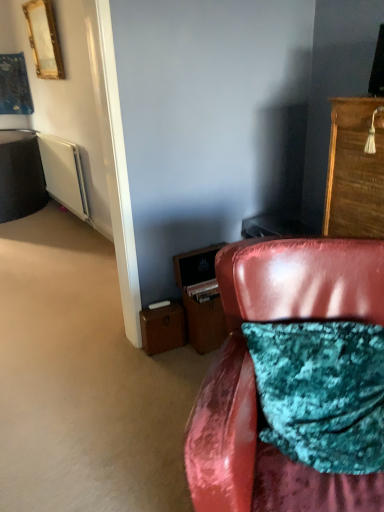
What do you see at coordinates (64, 174) in the screenshot?
I see `white matte radiator at left` at bounding box center [64, 174].

This screenshot has height=512, width=384. What do you see at coordinates (44, 39) in the screenshot? I see `gold-framed mirror at upper left` at bounding box center [44, 39].

Identify the location of gold-framed mirror at upper left. (44, 39).

Find the location of a particular element. This screenshot has width=384, height=512. wooden cabinet at upper right is located at coordinates (355, 170).

You are a GUI agent. You are given a task and a screenshot of the screen. Output one action in this format:
    pyautogui.click(x=<x>, y=<y>)
    Task: Click on the brown leather file cabinet at lower center
    
    Given the screenshot: What is the action you would take?
    pyautogui.click(x=201, y=298)

The width and height of the screenshot is (384, 512). Find the location of `white matte radiator at left`. white matte radiator at left is located at coordinates (64, 174).

Image resolution: width=384 pixels, height=512 pixels. Identify the location of chair above the wooden drawer at lower center, marked as the 1th drawer in a right-to-left arrangement (from a real-world perspective). (254, 376).

Is leather at lower right completely or partially outside of wooden drawer at lower center, marked as the 1th drawer in a right-to-left arrangement?

leather at lower right lies outside wooden drawer at lower center, marked as the 1th drawer in a right-to-left arrangement,'s area.

From the image's perspective, which object appears higher, leather at lower right or wooden drawer at lower center, which is counted as the second drawer, starting from the left?

wooden drawer at lower center, which is counted as the second drawer, starting from the left, is shown above in the image.

How distant is leather at lower right from wooden drawer at lower center, marked as the 1th drawer in a right-to-left arrangement?

33.70 inches.

Based on the photo, is wooden drawer at lower center, which is counted as the second drawer, starting from the left, completely or partially outside of brown leather suitcase at lower left, acting as the 2th drawer starting from the right?

Absolutely, wooden drawer at lower center, which is counted as the second drawer, starting from the left, is external to brown leather suitcase at lower left, acting as the 2th drawer starting from the right.

Is wooden drawer at lower center, marked as the 1th drawer in a right-to-left arrangement, facing towards brown leather suitcase at lower left, which ranks as the 1th drawer in left-to-right order?

No, wooden drawer at lower center, marked as the 1th drawer in a right-to-left arrangement, is not facing towards brown leather suitcase at lower left, which ranks as the 1th drawer in left-to-right order.

Which is farther from the camera, (204,313) or (161,310)?

The point (161,310) is farther.

The width and height of the screenshot is (384, 512). Find the location of `drawer that is below the wooden drawer at lower center, which is counted as the second drawer, starting from the left (from the image's perspective)`. drawer that is below the wooden drawer at lower center, which is counted as the second drawer, starting from the left (from the image's perspective) is located at coordinates (162, 328).

Consider the image. Can you confirm if wooden drawer at lower center, which is counted as the second drawer, starting from the left, is thinner than brown leather file cabinet at lower center?

Yes, wooden drawer at lower center, which is counted as the second drawer, starting from the left, is thinner than brown leather file cabinet at lower center.

Is wooden drawer at lower center, which is counted as the second drawer, starting from the left, with brown leather file cabinet at lower center?

Yes.

From their relative heights in the image, would you say wooden drawer at lower center, which is counted as the second drawer, starting from the left, is taller or shorter than brown leather file cabinet at lower center?

Clearly, wooden drawer at lower center, which is counted as the second drawer, starting from the left, is shorter compared to brown leather file cabinet at lower center.

Is wooden cabinet at upper right with wooden drawer at lower center, which is counted as the second drawer, starting from the left?

No, wooden cabinet at upper right is not next to wooden drawer at lower center, which is counted as the second drawer, starting from the left.

What's the angular difference between wooden cabinet at upper right and wooden drawer at lower center, marked as the 1th drawer in a right-to-left arrangement,'s facing directions?

There is a 85.6-degree angle between the facing directions of wooden cabinet at upper right and wooden drawer at lower center, marked as the 1th drawer in a right-to-left arrangement.

Does wooden cabinet at upper right appear on the right side of wooden drawer at lower center, which is counted as the second drawer, starting from the left?

Indeed, wooden cabinet at upper right is positioned on the right side of wooden drawer at lower center, which is counted as the second drawer, starting from the left.

Can you confirm if wooden cabinet at upper right is wider than wooden drawer at lower center, which is counted as the second drawer, starting from the left?

Yes.

Who is taller, brown leather suitcase at lower left, acting as the 2th drawer starting from the right, or gold-framed mirror at upper left?

Standing taller between the two is gold-framed mirror at upper left.

Who is more distant, brown leather suitcase at lower left, acting as the 2th drawer starting from the right, or gold-framed mirror at upper left?

gold-framed mirror at upper left is more distant.

Is brown leather suitcase at lower left, acting as the 2th drawer starting from the right, aimed at gold-framed mirror at upper left?

No, brown leather suitcase at lower left, acting as the 2th drawer starting from the right, is not oriented towards gold-framed mirror at upper left.

Which drawer is the 1st one when counting from the front of the gold-framed mirror at upper left? Please provide its 2D coordinates.

[(162, 328)]

Consider the image. Could brown leather file cabinet at lower center be considered to be inside leather at lower right?

No, brown leather file cabinet at lower center is not inside leather at lower right.

Is leather at lower right not near brown leather file cabinet at lower center?

No, leather at lower right is in close proximity to brown leather file cabinet at lower center.

In the image, is leather at lower right positioned in front of or behind brown leather file cabinet at lower center?

leather at lower right is positioned closer to the viewer than brown leather file cabinet at lower center.

Considering the positions of objects leather at lower right and brown leather file cabinet at lower center in the image provided, who is more to the right, leather at lower right or brown leather file cabinet at lower center?

leather at lower right.

Which object is more forward, white matte radiator at left or brown leather file cabinet at lower center?

brown leather file cabinet at lower center is closer to the camera.

Who is shorter, white matte radiator at left or brown leather file cabinet at lower center?

brown leather file cabinet at lower center.

How far apart are white matte radiator at left and brown leather file cabinet at lower center?

white matte radiator at left is 2.26 meters from brown leather file cabinet at lower center.

Identify the location of chair that is below the wooden drawer at lower center, marked as the 1th drawer in a right-to-left arrangement (from the image's perspective). (254, 376).

Locate an element on the screen. Image resolution: width=384 pixels, height=512 pixels. drawer above the brown leather suitcase at lower left, which ranks as the 1th drawer in left-to-right order (from the image's perspective) is located at coordinates (204, 322).

Estimate the real-world distances between objects in this image. Which object is further from leather at lower right, gold-framed mirror at upper left or brown leather file cabinet at lower center?

gold-framed mirror at upper left is positioned further to the anchor leather at lower right.

Considering their positions, is leather at lower right positioned further to wooden cabinet at upper right than white matte radiator at left?

white matte radiator at left.

When comparing their distances from leather at lower right, does brown leather file cabinet at lower center or white matte radiator at left seem closer?

brown leather file cabinet at lower center lies closer to leather at lower right than the other object.

Based on the photo, from the image, which object appears to be farther from white matte radiator at left, wooden cabinet at upper right or gold-framed mirror at upper left?

Among the two, wooden cabinet at upper right is located further to white matte radiator at left.

From the image, which object appears to be farther from wooden drawer at lower center, which is counted as the second drawer, starting from the left, gold-framed mirror at upper left or brown leather file cabinet at lower center?

Among the two, gold-framed mirror at upper left is located further to wooden drawer at lower center, which is counted as the second drawer, starting from the left.

Looking at this image, looking at the image, which one is located further to leather at lower right, wooden cabinet at upper right or white matte radiator at left?

Based on the image, white matte radiator at left appears to be further to leather at lower right.

Based on their spatial positions, is brown leather file cabinet at lower center or wooden cabinet at upper right further from white matte radiator at left?

wooden cabinet at upper right is positioned further to the anchor white matte radiator at left.

When comparing their distances from wooden cabinet at upper right, does gold-framed mirror at upper left or leather at lower right seem further?

The object further to wooden cabinet at upper right is gold-framed mirror at upper left.

Locate an element on the screen. cabinetry located between leather at lower right and wooden drawer at lower center, marked as the 1th drawer in a right-to-left arrangement, in the depth direction is located at coordinates (355, 170).

This screenshot has height=512, width=384. Identify the location of file cabinet located between wooden drawer at lower center, marked as the 1th drawer in a right-to-left arrangement, and wooden cabinet at upper right in the left-right direction. (201, 298).

The height and width of the screenshot is (512, 384). I want to click on cabinetry between gold-framed mirror at upper left and brown leather suitcase at lower left, which ranks as the 1th drawer in left-to-right order, from top to bottom, so click(x=355, y=170).

Where is `drawer positioned between leather at lower right and brown leather suitcase at lower left, acting as the 2th drawer starting from the right, from near to far`? This screenshot has height=512, width=384. drawer positioned between leather at lower right and brown leather suitcase at lower left, acting as the 2th drawer starting from the right, from near to far is located at coordinates click(x=204, y=322).